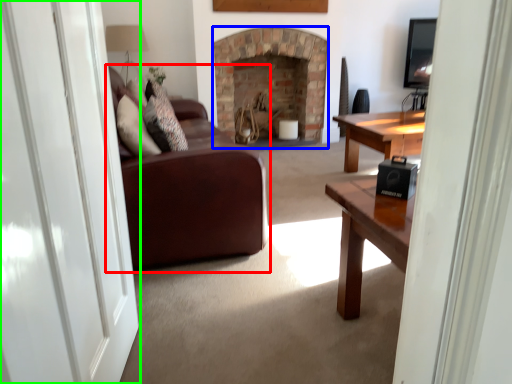
Question: Which object is the farthest from studio couch (highlighted by a red box)? Choose among these: fireplace (highlighted by a blue box) or screen door (highlighted by a green box).

Choices:
 (A) fireplace
 (B) screen door

Answer: (A)